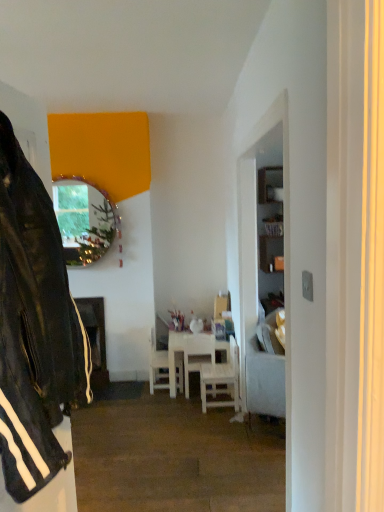
Question: Which direction should I rotate to look at white wooden chair at center, which ranks as the 3th chair in left-to-right order, — up or down?

Choices:
 (A) up
 (B) down

Answer: (B)

Question: Can you confirm if white wood chair at center, which is the 2th chair from left to right, is shorter than black leather jacket at left?

Choices:
 (A) no
 (B) yes

Answer: (B)

Question: Is white wood chair at center, the 2th chair when ordered from right to left, oriented away from black leather jacket at left?

Choices:
 (A) no
 (B) yes

Answer: (B)

Question: Is white wood chair at center, which is the 2th chair from left to right, smaller than black leather jacket at left?

Choices:
 (A) no
 (B) yes

Answer: (B)

Question: Could you tell me if white wood chair at center, which is the 2th chair from left to right, is turned towards black leather jacket at left?

Choices:
 (A) no
 (B) yes

Answer: (A)

Question: Is white wood chair at center, which is the 2th chair from left to right, in front of black leather jacket at left?

Choices:
 (A) yes
 (B) no

Answer: (B)

Question: Can you confirm if white wood chair at center, the 2th chair when ordered from right to left, is positioned to the left of black leather jacket at left?

Choices:
 (A) yes
 (B) no

Answer: (B)

Question: Is white wood chair at center, which is the 2th chair from left to right, completely or partially inside white wood chair at center, the 1th chair from the left?

Choices:
 (A) no
 (B) yes

Answer: (A)

Question: From a real-world perspective, is white wood chair at center, the 1th chair from the left, under white wood chair at center, which is the 2th chair from left to right?

Choices:
 (A) yes
 (B) no

Answer: (B)

Question: From a real-world perspective, is white wood chair at center, which is the 3th chair from right to left, located higher than white wood chair at center, the 2th chair when ordered from right to left?

Choices:
 (A) no
 (B) yes

Answer: (B)

Question: Considering the relative positions of white wood chair at center, which is the 3th chair from right to left, and white wood chair at center, which is the 2th chair from left to right, in the image provided, is white wood chair at center, which is the 3th chair from right to left, to the left of white wood chair at center, which is the 2th chair from left to right, from the viewer's perspective?

Choices:
 (A) yes
 (B) no

Answer: (A)

Question: Does white wood chair at center, which is the 3th chair from right to left, touch white wood chair at center, which is the 2th chair from left to right?

Choices:
 (A) no
 (B) yes

Answer: (A)

Question: Does white wood chair at center, which is the 3th chair from right to left, have a lesser width compared to white wood chair at center, the 2th chair when ordered from right to left?

Choices:
 (A) no
 (B) yes

Answer: (A)

Question: Can you confirm if metallic reflective mirror at upper left is bigger than light gray fabric couch at right?

Choices:
 (A) yes
 (B) no

Answer: (B)